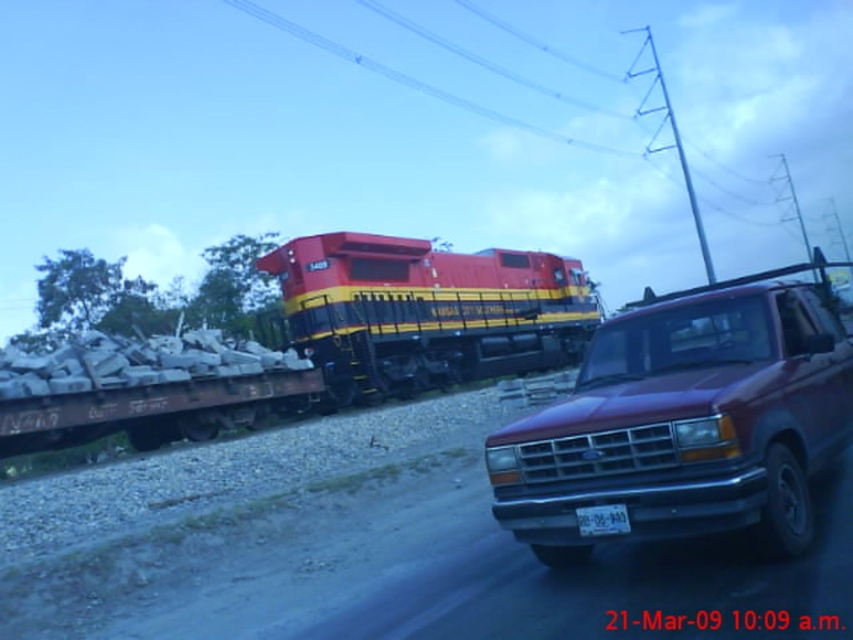
Question: Which object appears farthest from the camera in this image?

Choices:
 (A) matte black truck at center
 (B) white plastic license plate at center
 (C) maroon metallic truck at right
 (D) red/yellow/black locomotive at center

Answer: (A)

Question: Can you confirm if red/yellow/black locomotive at center is positioned below matte black truck at center?

Choices:
 (A) no
 (B) yes

Answer: (B)

Question: Which object appears farthest from the camera in this image?

Choices:
 (A) red/yellow/black locomotive at center
 (B) maroon metallic truck at right

Answer: (A)

Question: Can you confirm if matte black truck at center is positioned to the right of white plastic license plate at center?

Choices:
 (A) yes
 (B) no

Answer: (A)

Question: Among these points, which one is nearest to the camera?

Choices:
 (A) (619, 396)
 (B) (339, 344)
 (C) (361, 356)

Answer: (A)

Question: Is the position of maroon metallic truck at right more distant than that of red/yellow/black locomotive at center?

Choices:
 (A) yes
 (B) no

Answer: (B)